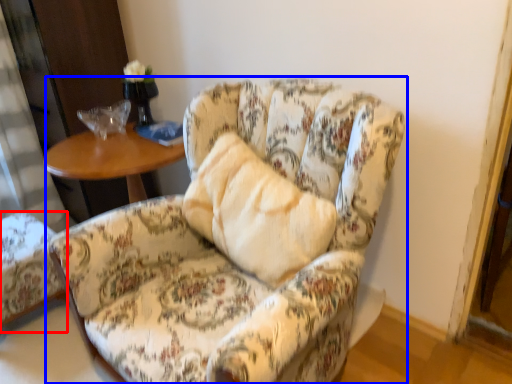
Question: Which of the following is the closest to the observer, chair (highlighted by a red box) or chair (highlighted by a blue box)?

Choices:
 (A) chair
 (B) chair

Answer: (B)